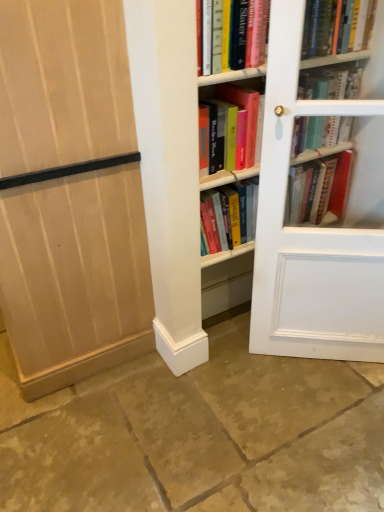
Question: Is hardcover book at center, which appears as the first book when viewed from the right, positioned beyond the bounds of brown stone floor at lower center?

Choices:
 (A) yes
 (B) no

Answer: (A)

Question: Could you tell me if hardcover book at center, which appears as the first book when viewed from the right, is turned towards brown stone floor at lower center?

Choices:
 (A) yes
 (B) no

Answer: (B)

Question: Can you confirm if hardcover book at center, which appears as the first book when viewed from the right, is shorter than brown stone floor at lower center?

Choices:
 (A) yes
 (B) no

Answer: (B)

Question: Would you say hardcover book at center, placed as the 3th book when sorted from left to right, contains brown stone floor at lower center?

Choices:
 (A) no
 (B) yes

Answer: (A)

Question: Considering the relative sizes of hardcover book at center, placed as the 3th book when sorted from left to right, and brown stone floor at lower center in the image provided, is hardcover book at center, placed as the 3th book when sorted from left to right, wider than brown stone floor at lower center?

Choices:
 (A) no
 (B) yes

Answer: (A)

Question: From a real-world perspective, is hardcover book at center, which appears as the first book when viewed from the right, above or below light wood paneling at left?

Choices:
 (A) below
 (B) above

Answer: (B)

Question: Relative to light wood paneling at left, is hardcover book at center, placed as the 3th book when sorted from left to right, in front or behind?

Choices:
 (A) front
 (B) behind

Answer: (B)

Question: From their relative heights in the image, would you say hardcover book at center, which appears as the first book when viewed from the right, is taller or shorter than light wood paneling at left?

Choices:
 (A) tall
 (B) short

Answer: (B)

Question: Is point (304, 142) closer or farther from the camera than point (69, 30)?

Choices:
 (A) farther
 (B) closer

Answer: (A)

Question: From the image's perspective, is brown stone floor at lower center located above or below light wood paneling at left?

Choices:
 (A) below
 (B) above

Answer: (A)

Question: Based on their positions, is brown stone floor at lower center located to the left or right of light wood paneling at left?

Choices:
 (A) left
 (B) right

Answer: (B)

Question: In terms of width, does brown stone floor at lower center look wider or thinner when compared to light wood paneling at left?

Choices:
 (A) wide
 (B) thin

Answer: (A)

Question: In the image, is brown stone floor at lower center positioned in front of or behind light wood paneling at left?

Choices:
 (A) behind
 (B) front

Answer: (B)

Question: Considering the positions of white glass door at right and hardcover book at center, placed as the 3th book when sorted from left to right, in the image, is white glass door at right wider or thinner than hardcover book at center, placed as the 3th book when sorted from left to right,?

Choices:
 (A) wide
 (B) thin

Answer: (B)

Question: From a real-world perspective, is white glass door at right above or below hardcover book at center, placed as the 3th book when sorted from left to right?

Choices:
 (A) above
 (B) below

Answer: (B)